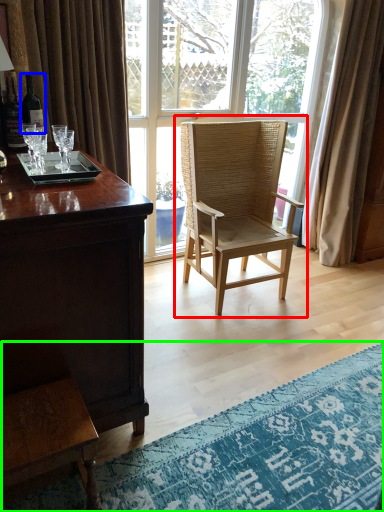
Question: Considering the real-world distances, which object is farthest from chair (highlighted by a red box)? bottle (highlighted by a blue box) or mat (highlighted by a green box)?

Choices:
 (A) bottle
 (B) mat

Answer: (A)